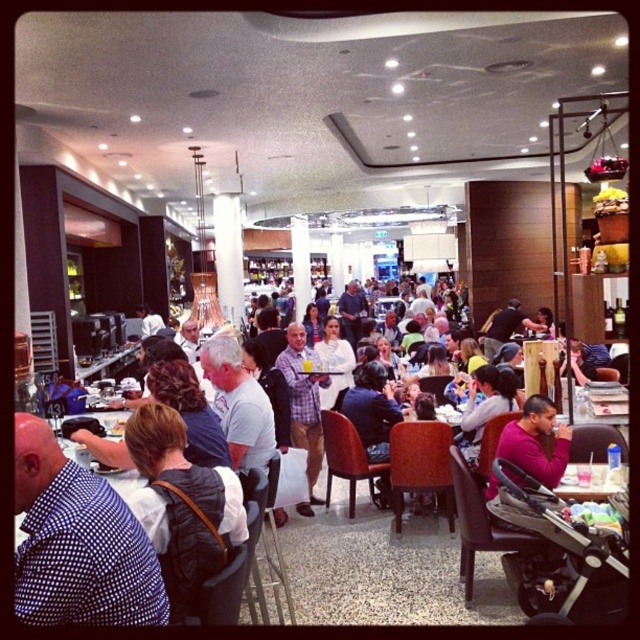
Question: Which object is positioned farthest from the plaid shirt at center?

Choices:
 (A) purple sweater at center
 (B) blue checkered shirt at lower left

Answer: (B)

Question: Does blue checkered shirt at lower left have a lesser width compared to matte white shirt at center?

Choices:
 (A) yes
 (B) no

Answer: (A)

Question: Based on their relative distances, which object is farther from the blue checkered shirt at lower left?

Choices:
 (A) purple sweater at center
 (B) matte white shirt at center
 (C) plaid shirt at center

Answer: (B)

Question: Can you confirm if plaid shirt at center is thinner than matte white shirt at center?

Choices:
 (A) no
 (B) yes

Answer: (B)

Question: Which of these objects is positioned farthest from the purple sweater at center?

Choices:
 (A) plaid shirt at center
 (B) blue checkered shirt at lower left

Answer: (B)

Question: Is purple sweater at center in front of matte white shirt at center?

Choices:
 (A) yes
 (B) no

Answer: (A)